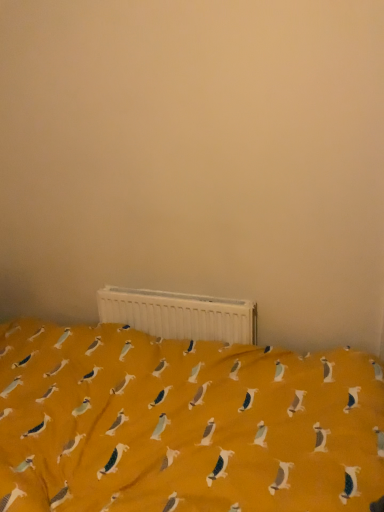
Locate an element on the screen. white plastic radiator at center is located at coordinates (179, 314).

This screenshot has height=512, width=384. What do you see at coordinates (179, 314) in the screenshot? I see `white plastic radiator at center` at bounding box center [179, 314].

Locate an element on the screen. Image resolution: width=384 pixels, height=512 pixels. white plastic radiator at center is located at coordinates (179, 314).